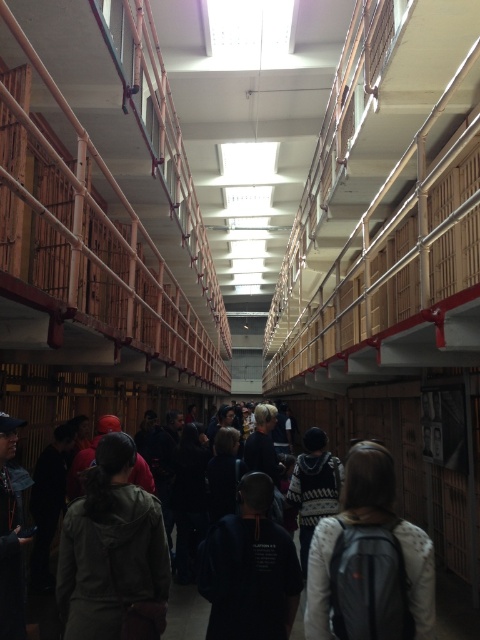
You are a tour guide leading a group through the Alcatraz prison cell block. You notice a visitor wearing a green matte jacket at center. Where exactly is the green matte jacket located in the scene?

The green matte jacket at center is located at coordinates point (112,554).

You are a tour guide leading a group through Alcatraz. You notice a green matte jacket at center and a dark gray backpack at center. Can you determine which one is wider?

The green matte jacket at center might be wider than dark gray backpack at center.